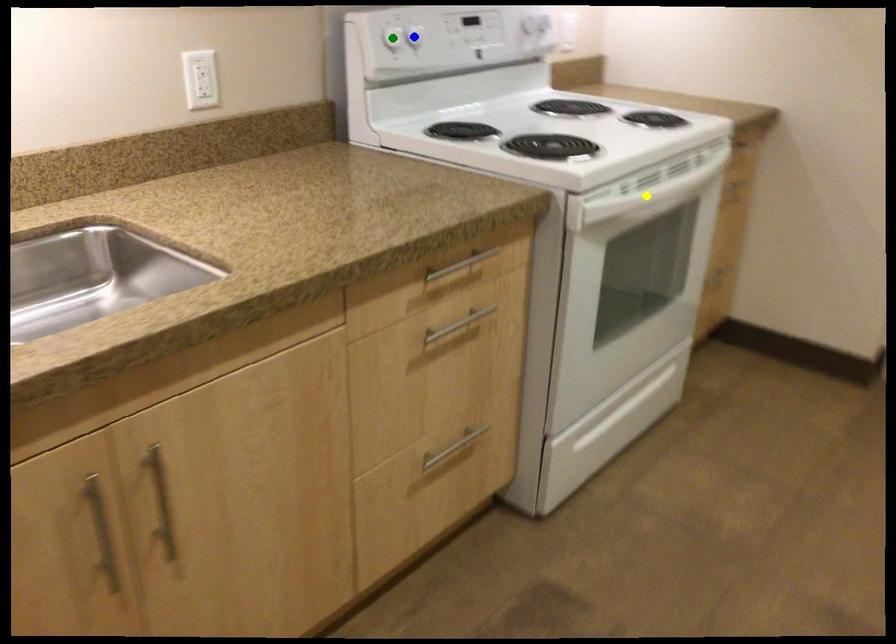
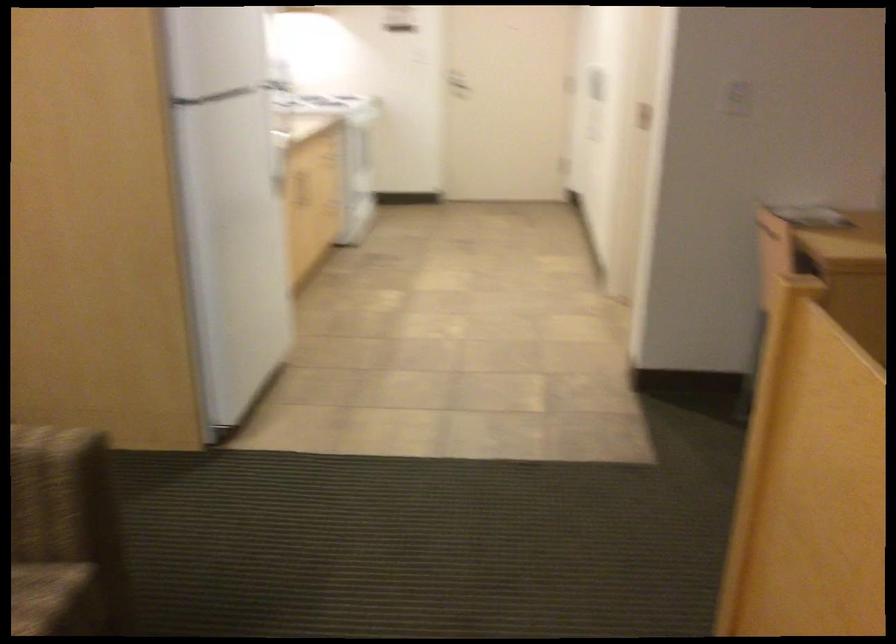
I am providing you with two images of the same scene from different viewpoints. Three points are marked in image1. Which point corresponds to a part or object that is occluded in image2?In image1, three points are marked. Which of them correspond to a part or object that is occluded in image2?Among the three points shown in image1, which one corresponds to a part or object that is no longer visible due to occlusion in image2?

Invisible in image2: yellow point, blue point, green point.